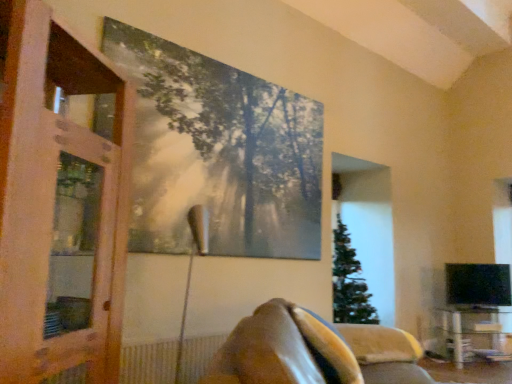
Locate an element on the screen. Image resolution: width=512 pixels, height=384 pixels. brown leather couch at lower center is located at coordinates (313, 351).

What do you see at coordinates (225, 159) in the screenshot?
I see `metallic silver tree at upper center` at bounding box center [225, 159].

In order to click on clear glass table at lower right in this screenshot , I will do `click(472, 333)`.

Locate an element on the screen. wooden screen door at left is located at coordinates (61, 201).

Can you confirm if clear glass table at lower right is wider than wooden screen door at left?

Indeed, clear glass table at lower right has a greater width compared to wooden screen door at left.

From the image's perspective, between clear glass table at lower right and wooden screen door at left, who is located below?

clear glass table at lower right.

Does clear glass table at lower right have a lesser height compared to wooden screen door at left?

Yes.

Between point (21, 368) and point (463, 336), which one is positioned behind?

Positioned behind is point (463, 336).

Can you confirm if wooden screen door at left is smaller than clear glass table at lower right?

No.

Does wooden screen door at left contain clear glass table at lower right?

No, wooden screen door at left does not contain clear glass table at lower right.

Between metallic silver tree at upper center and brown leather couch at lower center, which one appears on the left side from the viewer's perspective?

metallic silver tree at upper center.

From a real-world perspective, is metallic silver tree at upper center located beneath brown leather couch at lower center?

No.

Could you tell me if metallic silver tree at upper center is facing brown leather couch at lower center?

No, metallic silver tree at upper center is not oriented towards brown leather couch at lower center.

Between metallic silver tree at upper center and brown leather couch at lower center, which one has larger size?

brown leather couch at lower center.

Identify the location of screen door on the left of the brown leather couch at lower center. Image resolution: width=512 pixels, height=384 pixels. (61, 201).

From a real-world perspective, is brown leather couch at lower center beneath wooden screen door at left?

Yes, from a real-world perspective, brown leather couch at lower center is below wooden screen door at left.

Relative to wooden screen door at left, is brown leather couch at lower center in front or behind?

Visually, brown leather couch at lower center is located in front of wooden screen door at left.

Can you tell me how much brown leather couch at lower center and wooden screen door at left differ in facing direction?

The angular difference between brown leather couch at lower center and wooden screen door at left is 5.55 degrees.

Does metallic silver tree at upper center have a smaller size compared to clear glass table at lower right?

Yes.

In the scene shown: From the image's perspective, does metallic silver tree at upper center appear lower than clear glass table at lower right?

Incorrect, from the image's perspective, metallic silver tree at upper center is higher than clear glass table at lower right.

Is metallic silver tree at upper center outside of clear glass table at lower right?

Yes, metallic silver tree at upper center is located beyond the bounds of clear glass table at lower right.

Which is behind, point (185, 149) or point (457, 337)?

The point (457, 337) is farther.

Is metallic silver tree at upper center next to velvety brown pillow at lower center?

No, metallic silver tree at upper center is not making contact with velvety brown pillow at lower center.

Which is closer, (308,102) or (298,327)?

Point (308,102) appears to be farther away from the viewer than point (298,327).

Is metallic silver tree at upper center to the left or to the right of velvety brown pillow at lower center in the image?

metallic silver tree at upper center is to the left of velvety brown pillow at lower center.

Between metallic silver tree at upper center and velvety brown pillow at lower center, which one has larger size?

velvety brown pillow at lower center is bigger.

Is brown leather couch at lower center spatially inside clear glass table at lower right, or outside of it?

brown leather couch at lower center exists outside the volume of clear glass table at lower right.

Considering their positions, is brown leather couch at lower center located in front of or behind clear glass table at lower right?

Clearly, brown leather couch at lower center is in front of clear glass table at lower right.

How many degrees apart are the facing directions of brown leather couch at lower center and clear glass table at lower right?

The facing directions of brown leather couch at lower center and clear glass table at lower right are 78.9 degrees apart.

The width and height of the screenshot is (512, 384). Find the location of `furniture above the clear glass table at lower right (from a real-world perspective)`. furniture above the clear glass table at lower right (from a real-world perspective) is located at coordinates (313, 351).

Identify the location of screen door lying on the left of clear glass table at lower right. Image resolution: width=512 pixels, height=384 pixels. (61, 201).

This screenshot has width=512, height=384. Identify the location of table below the wooden screen door at left (from a real-world perspective). click(472, 333).

From the image, which object appears to be nearer to brown leather couch at lower center, clear glass table at lower right or velvety brown pillow at lower center?

velvety brown pillow at lower center is closer to brown leather couch at lower center.

Consider the image. Based on their spatial positions, is metallic silver tree at upper center or wooden screen door at left closer to velvety brown pillow at lower center?

wooden screen door at left is closer to velvety brown pillow at lower center.

Based on their spatial positions, is velvety brown pillow at lower center or brown leather couch at lower center further from wooden screen door at left?

velvety brown pillow at lower center is further to wooden screen door at left.

Based on their spatial positions, is clear glass table at lower right or wooden screen door at left further from metallic silver tree at upper center?

clear glass table at lower right is further to metallic silver tree at upper center.

Looking at the image, which one is located closer to metallic silver tree at upper center, clear glass table at lower right or brown leather couch at lower center?

brown leather couch at lower center.

From the image, which object appears to be farther from brown leather couch at lower center, metallic silver tree at upper center or clear glass table at lower right?

Based on the image, clear glass table at lower right appears to be further to brown leather couch at lower center.

Estimate the real-world distances between objects in this image. Which object is further from brown leather couch at lower center, wooden screen door at left or clear glass table at lower right?

clear glass table at lower right is positioned further to the anchor brown leather couch at lower center.

From the image, which object appears to be nearer to clear glass table at lower right, metallic silver tree at upper center or brown leather couch at lower center?

brown leather couch at lower center.

Locate an element on the screen. pillow situated between wooden screen door at left and brown leather couch at lower center from left to right is located at coordinates (328, 347).

This screenshot has width=512, height=384. What are the coordinates of `pillow positioned between brown leather couch at lower center and metallic silver tree at upper center from near to far` in the screenshot? It's located at (328, 347).

The width and height of the screenshot is (512, 384). Identify the location of screen door between brown leather couch at lower center and metallic silver tree at upper center along the z-axis. (61, 201).

Locate an element on the screen. tree between brown leather couch at lower center and clear glass table at lower right from front to back is located at coordinates (225, 159).